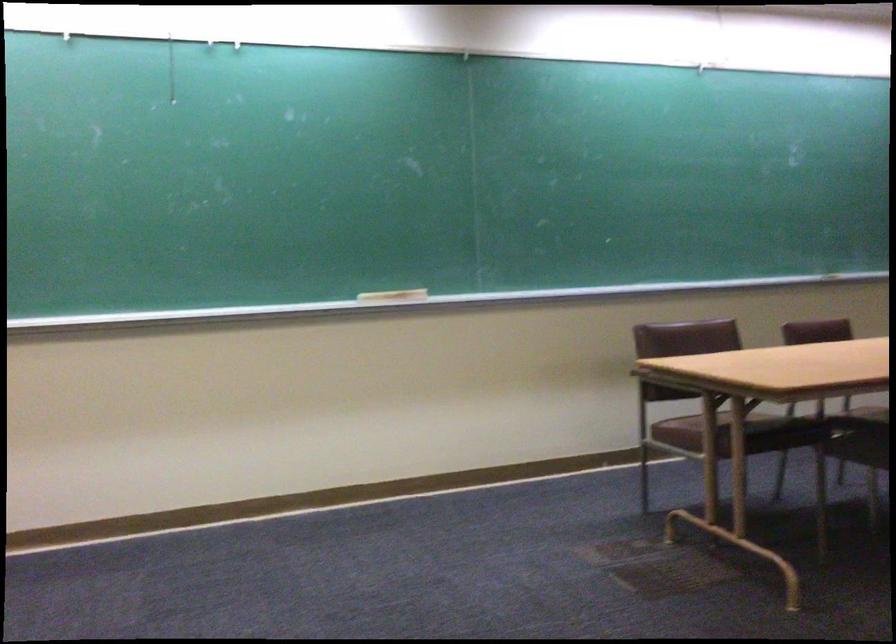
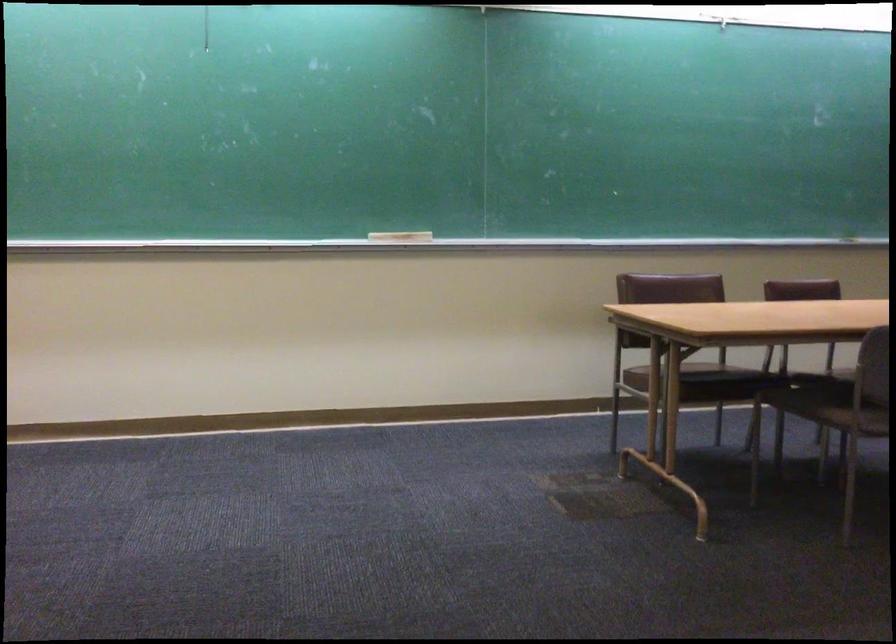
Question: The camera is either moving clockwise (left) or counter-clockwise (right) around the object. The first image is from the beginning of the video and the second image is from the end. Is the camera moving left or right when shooting the video?

Choices:
 (A) Left
 (B) Right

Answer: (B)